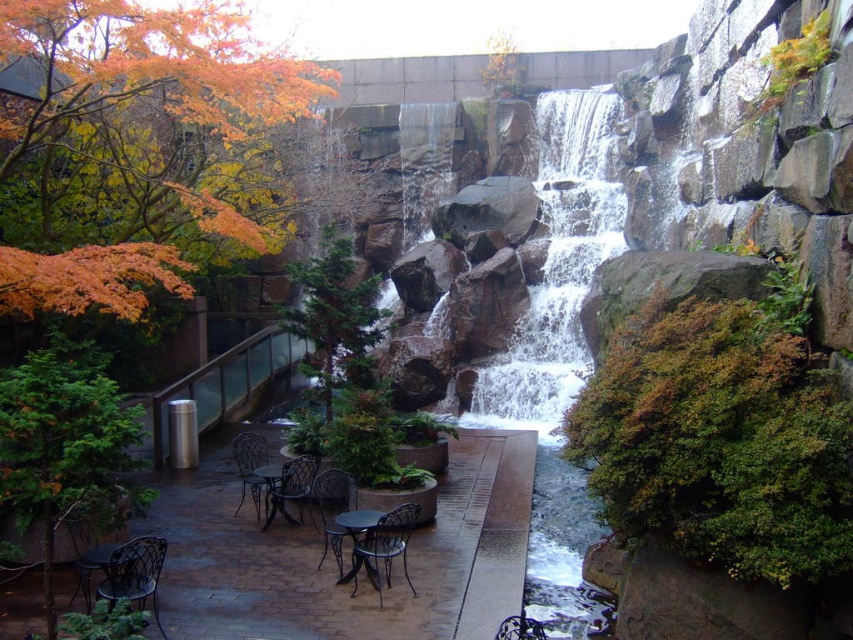
You are a guest at this outdoor area and want to sit down. You see the metallic dark green chair at lower center and the metallic black chair at lower center. Which chair is positioned higher up relative to the other?

The metallic dark green chair at lower center is located above the metallic black chair at lower center, so it is positioned higher up.

You are standing at the origin point of the coordinate system in the image. You want to move towards the waterfall but need to avoid the metallic dark green chair at lower center. What direction should you move to go around it?

The metallic dark green chair at lower center is located at point (387,540). Since you are at the origin, moving in a direction away from this coordinate would help avoid it. For example, moving towards the negative y or x direction might be suitable, but specific directions depend on the image layout.

You are planning to host a small gathering and need to accommodate guests comfortably. You have two chairs available in the area shown in the image. Which chair between the metallic dark brown chair at lower left and the metallic black chair at lower center would be more suitable for a guest who prefers a spacious seating option?

The metallic dark brown chair at lower left is larger in size compared to the metallic black chair at lower center, making it more suitable for a guest who prefers a spacious seating option.